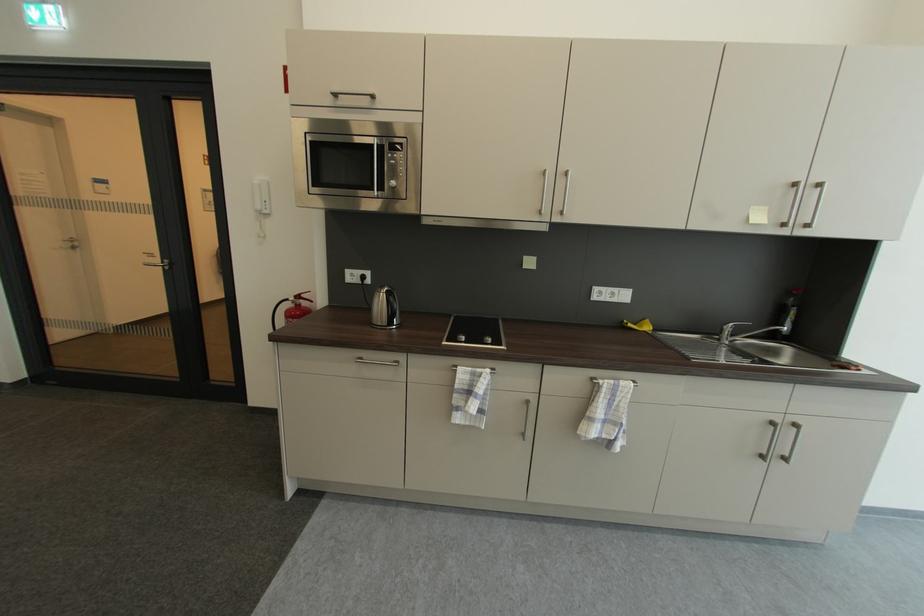
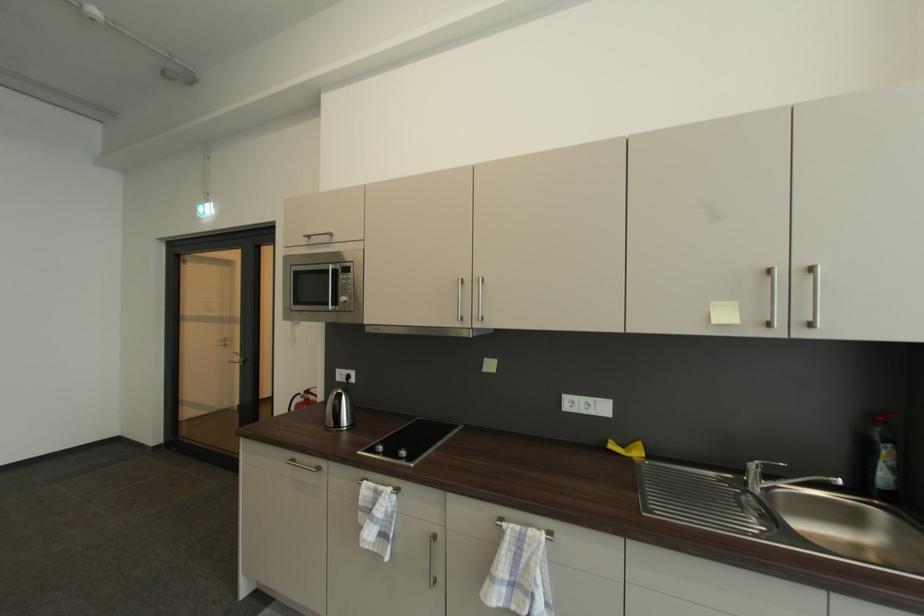
Question: I am providing you with two images of the same scene from different viewpoints. Which of the following objects are not visible in image2?

Choices:
 (A) towel rack handle
 (B) electric kettle
 (C) microwave dial
 (D) none of these

Answer: (D)